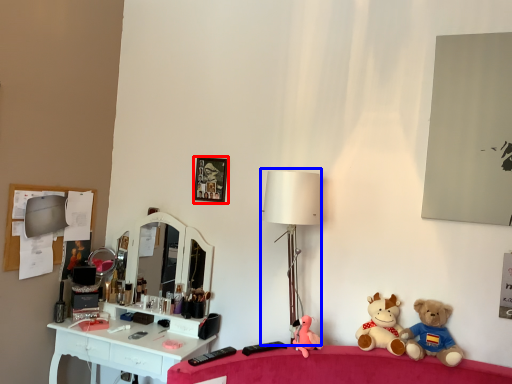
Question: Which object is closer to the camera taking this photo, picture frame (highlighted by a red box) or table lamp (highlighted by a blue box)?

Choices:
 (A) picture frame
 (B) table lamp

Answer: (B)